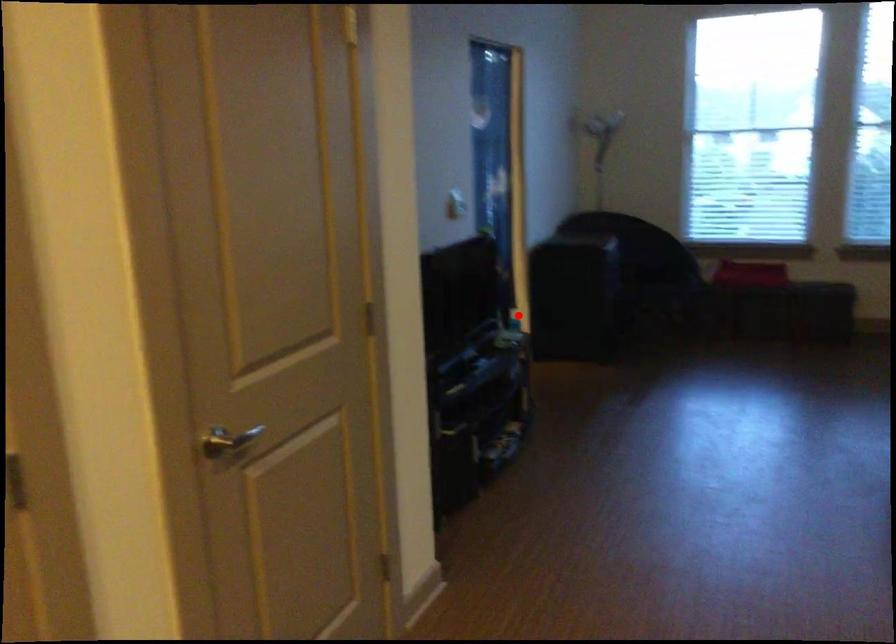
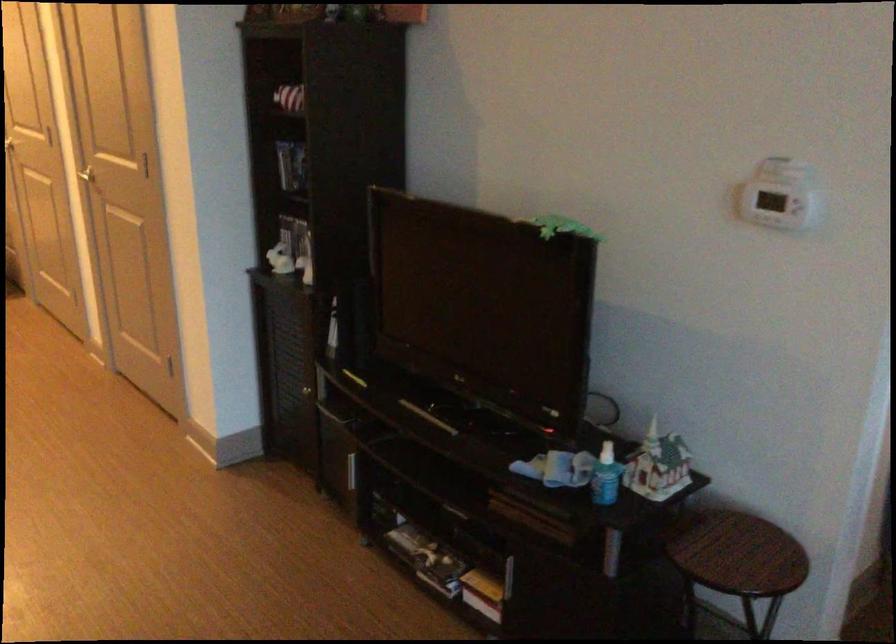
Where in the second image is the point corresponding to the highlighted location from the first image?

(606, 476)